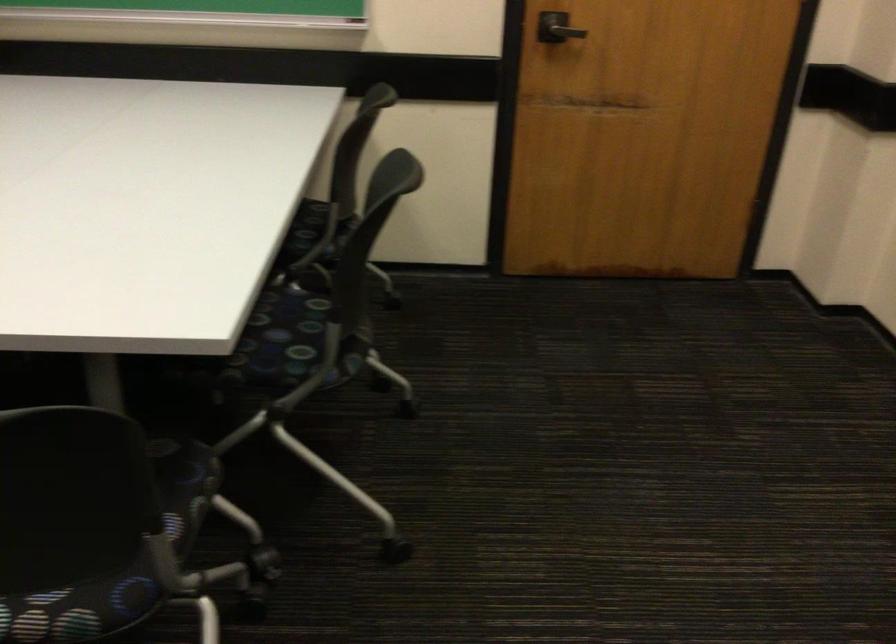
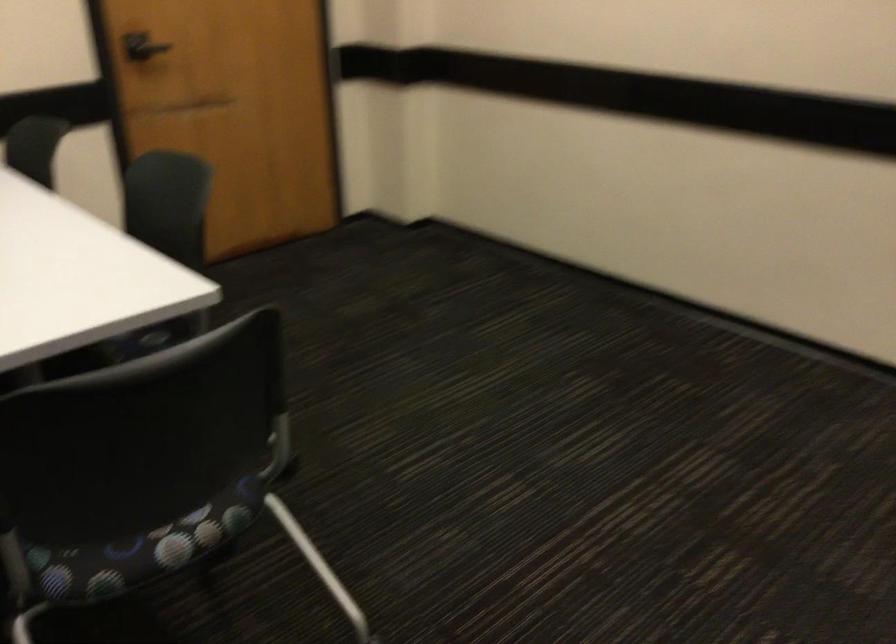
Question: The first image is from the beginning of the video and the second image is from the end. How did the camera likely rotate when shooting the video?

Choices:
 (A) Left
 (B) Right
 (C) Up
 (D) Down

Answer: (B)